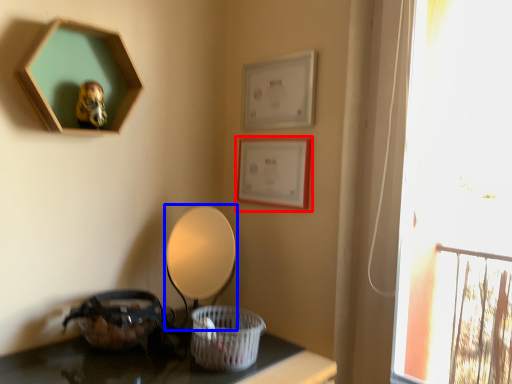
Question: Which object is further to the camera taking this photo, picture frame (highlighted by a red box) or table lamp (highlighted by a blue box)?

Choices:
 (A) picture frame
 (B) table lamp

Answer: (A)